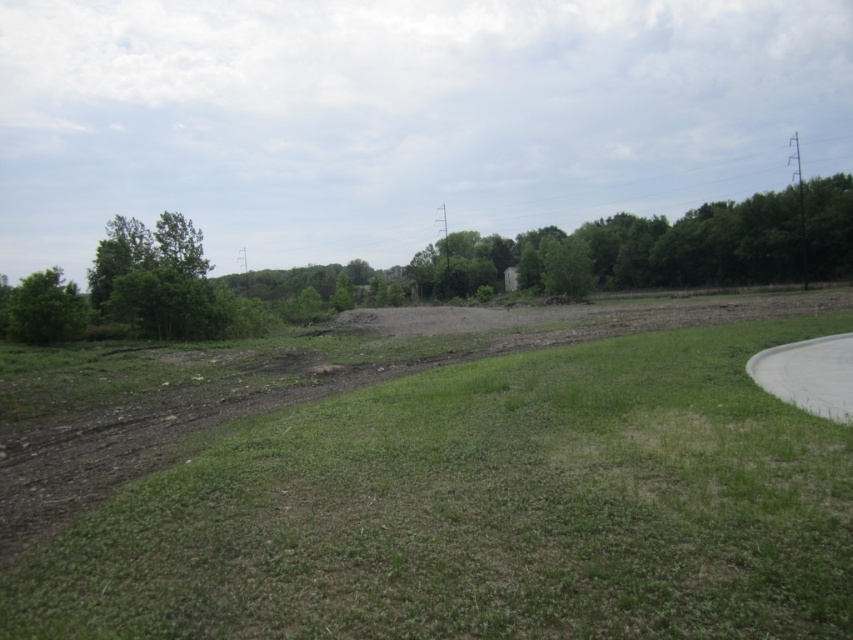
You are a gardener planning to plant a new flower bed. You have two options for locations in the scene described. The first is near the green grass at center, and the second is near the green leafy tree at left. Which location would provide more space for your flower bed?

The green leafy tree at left is larger than the green grass at center, so the area near the green grass at center would provide more space for the flower bed since it is smaller and might have more open ground available.

You are standing at the point with coordinates point (35, 317) and want to walk towards the point with coordinates point (410, 616). Will you have to walk through any obstacles between them?

Point (410, 616) is in front of point (35, 317), so you will not have to walk through any obstacles between them.